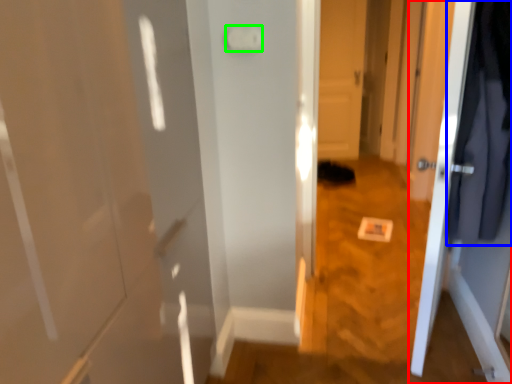
Question: Based on their relative distances, which object is farther from door (highlighted by a red box)? Choose from clothing (highlighted by a blue box) and light switch (highlighted by a green box).

Choices:
 (A) clothing
 (B) light switch

Answer: (B)